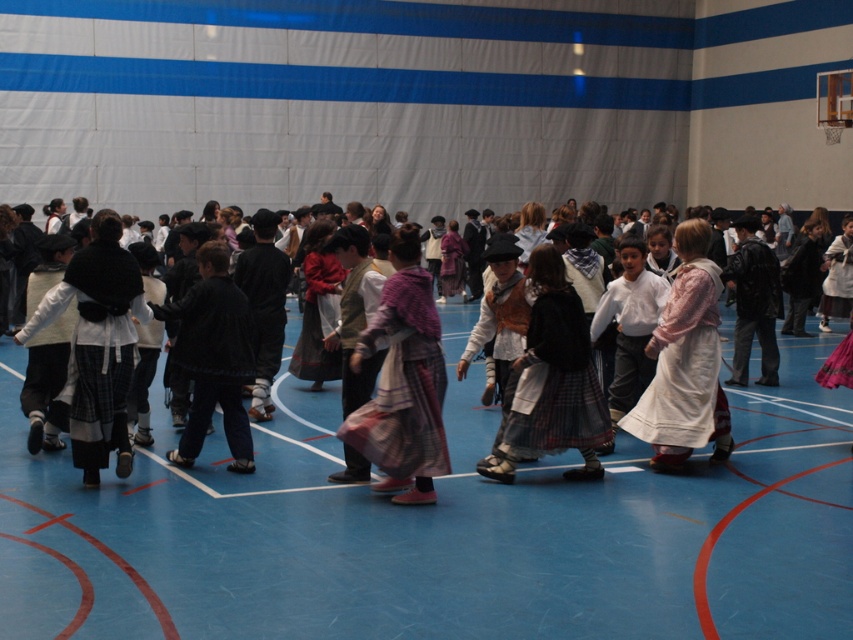
You are a photographer standing at the back of the gymnasium. You need to capture a photo of the white cotton dress at center and the white cotton shirt at center. Based on their sizes, which one is more likely to be visible in the photo?

The white cotton dress at center might be wider than white cotton shirt at center, so the white cotton dress at center is more likely to be visible in the photo due to its potentially larger size.

You are a photographer standing at the back of the gymnasium. You want to take a photo of the white cotton dress at center without the blue rubber basketball court at center blocking the view. Is this possible?

The blue rubber basketball court at center is in front of the white cotton dress at center, so it will block the view. Move closer to ensure the white cotton dress at center is visible without obstruction.